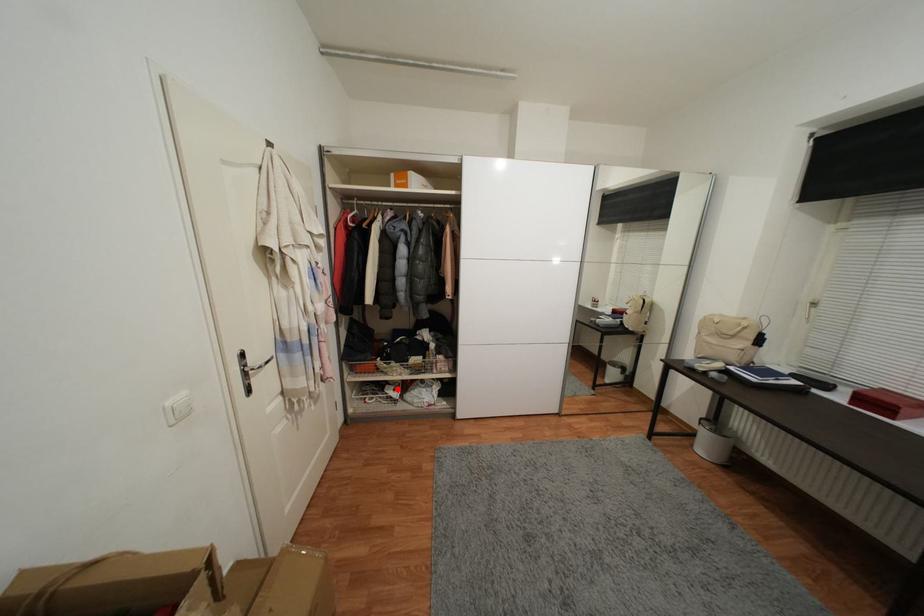
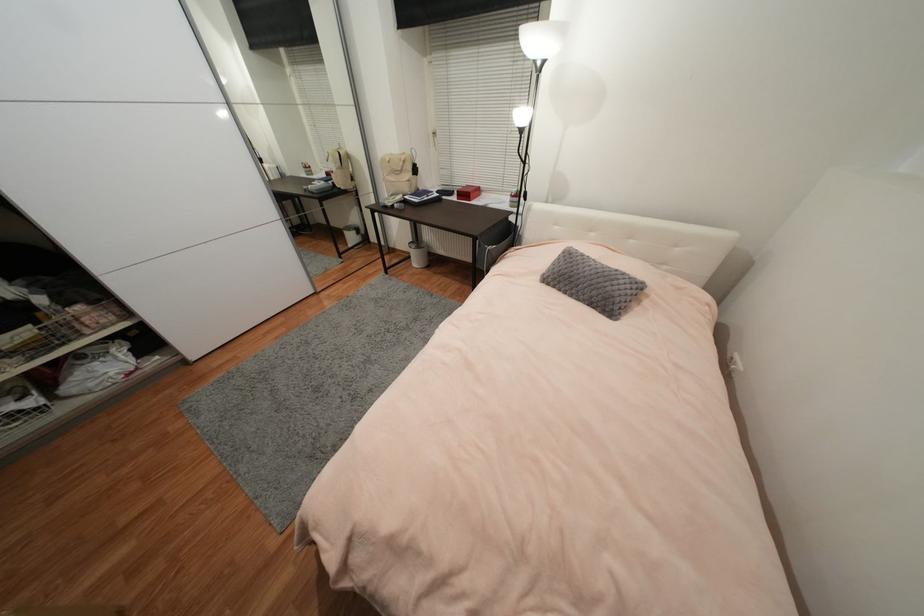
Question: I am providing you with two images of the same scene from different viewpoints. A red point is marked on the first image. At the location where the point appears in image 1, is it still visible in image 2?

Choices:
 (A) Yes
 (B) No

Answer: (A)